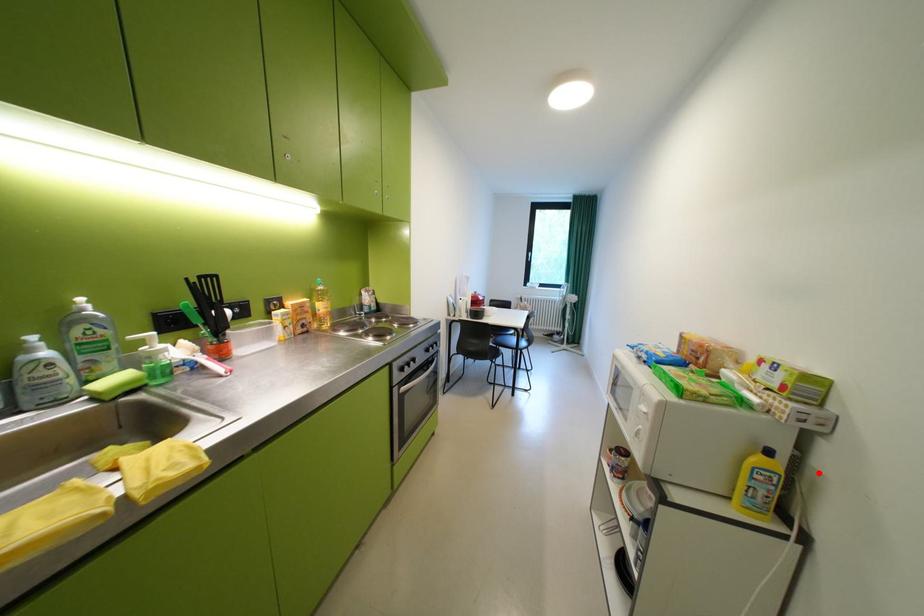
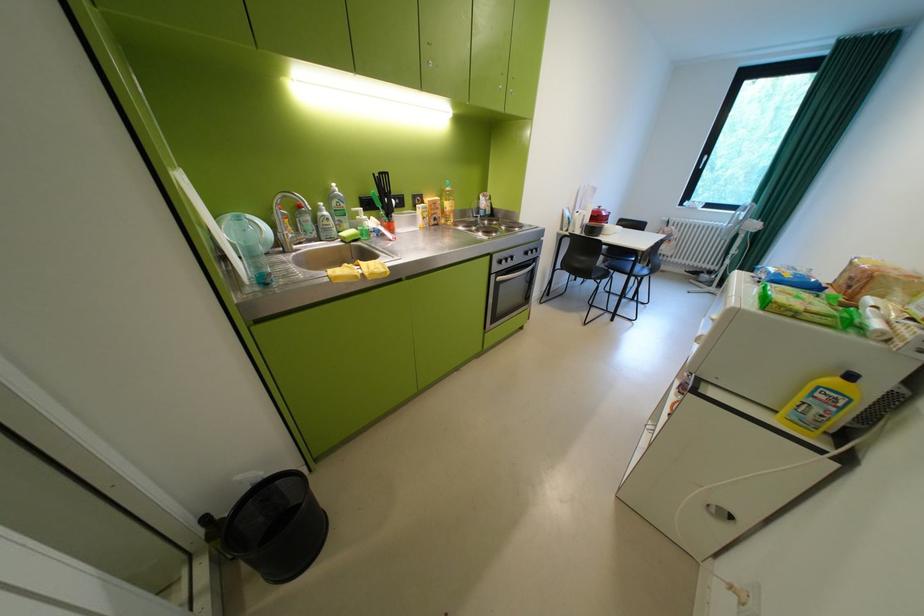
Question: I am providing you with two images of the same scene from different viewpoints. A red point is shown in image1. For the corresponding object point in image2, is it positioned nearer or farther from the camera?

Choices:
 (A) Nearer
 (B) Farther

Answer: (B)